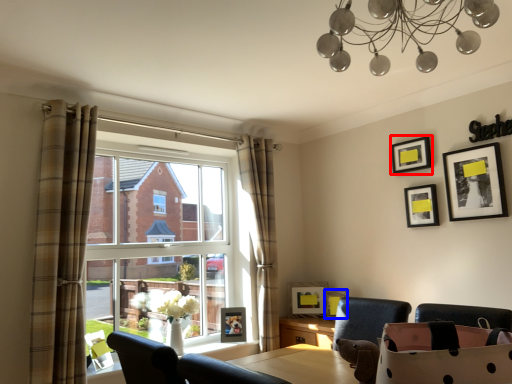
Question: Which of the following is the closest to the observer, picture frame (highlighted by a red box) or picture frame (highlighted by a blue box)?

Choices:
 (A) picture frame
 (B) picture frame

Answer: (A)